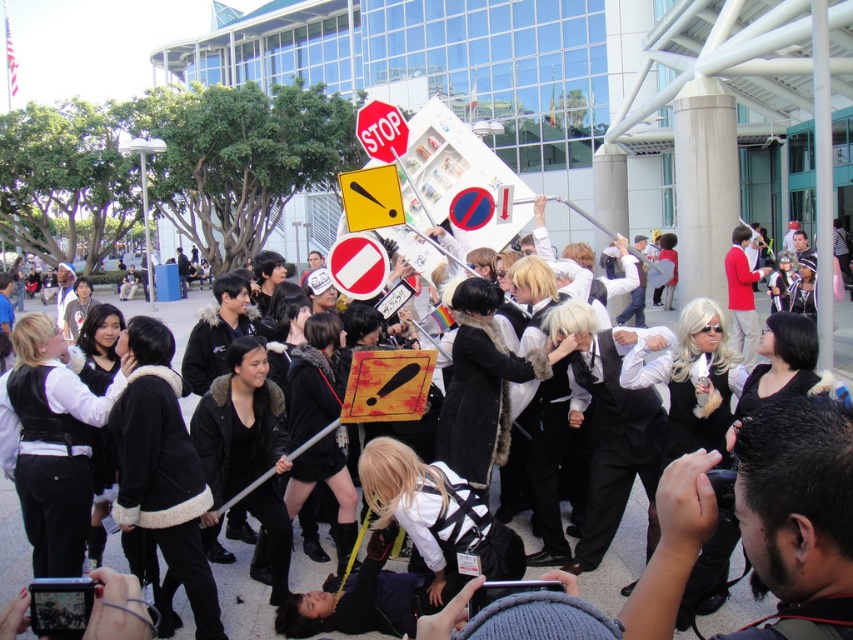
Question: Does white fur-trimmed jacket at center appear on the left side of red plastic stop sign at center?

Choices:
 (A) no
 (B) yes

Answer: (B)

Question: Which point is farther to the camera?

Choices:
 (A) red matte stop sign at center
 (B) red plastic stop sign at center

Answer: (B)

Question: Which object is positioned farthest from the white fur-trimmed jacket at center?

Choices:
 (A) red matte stop sign at center
 (B) red plastic stop sign at center

Answer: (B)

Question: Which point is closer to the camera?

Choices:
 (A) white fur-trimmed jacket at center
 (B) red plastic stop sign at center

Answer: (A)

Question: Is white fur-trimmed jacket at center below red plastic stop sign at center?

Choices:
 (A) yes
 (B) no

Answer: (A)

Question: Does white fur-trimmed jacket at center appear on the left side of red matte stop sign at center?

Choices:
 (A) yes
 (B) no

Answer: (A)